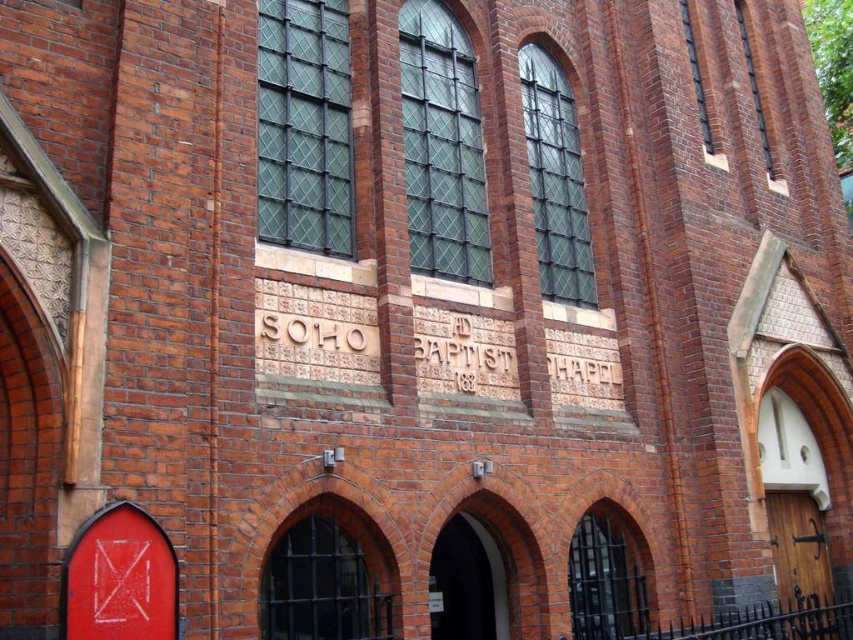
Which is behind, point (67, 634) or point (808, 618)?

The point (808, 618) is more distant.

Consider the image. Measure the distance between point (x=161, y=628) and camera.

Point (x=161, y=628) and camera are 26.23 meters apart.

Find the location of a particular element. The height and width of the screenshot is (640, 853). smooth red door at lower left is located at coordinates (119, 579).